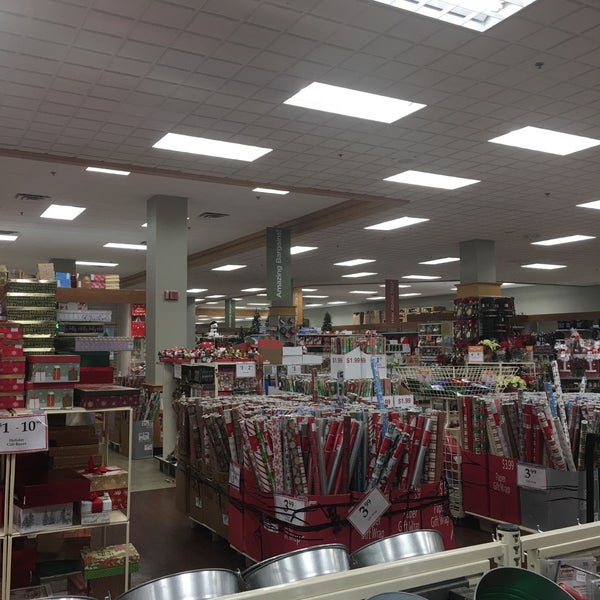
Find the location of a particular element. wall is located at coordinates (543, 333).